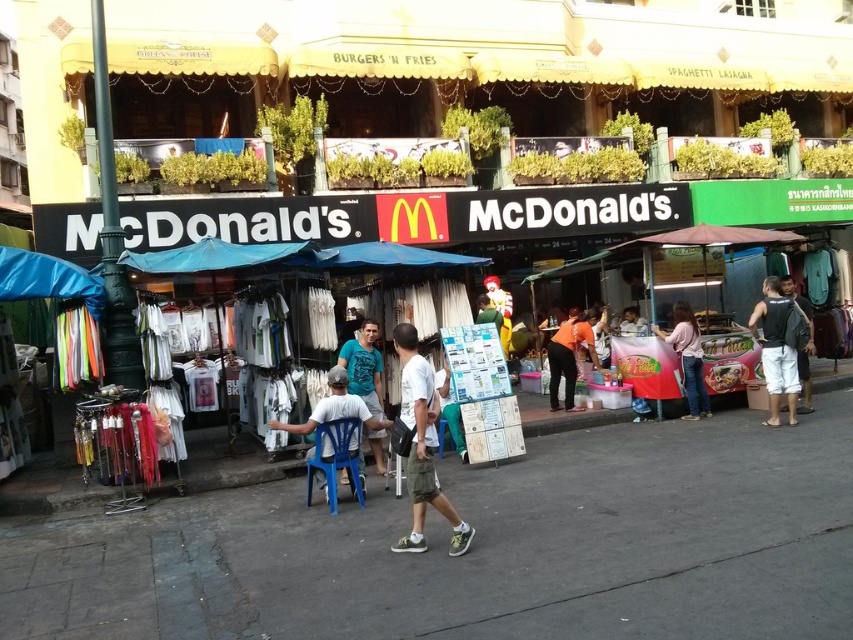
Between gray concrete pavement at center and pink fabric dress at center, which one appears on the right side from the viewer's perspective?

From the viewer's perspective, pink fabric dress at center appears more on the right side.

Is gray concrete pavement at center positioned at the back of pink fabric dress at center?

No, gray concrete pavement at center is closer to the viewer.

At what (x,y) coordinates should I click in order to perform the action: click on gray concrete pavement at center. Please return your answer as a coordinate pair (x, y). Looking at the image, I should click on (480, 548).

Locate an element on the screen. The width and height of the screenshot is (853, 640). gray concrete pavement at center is located at coordinates (480, 548).

Is point (346, 369) positioned behind point (810, 410)?

No, (346, 369) is in front of (810, 410).

Locate an element on the screen. The image size is (853, 640). green t-shirt at center is located at coordinates (364, 365).

Does point (368, 339) come behind point (781, 288)?

No, it is in front of (781, 288).

Image resolution: width=853 pixels, height=640 pixels. In order to click on green t-shirt at center in this screenshot , I will do `click(364, 365)`.

Can you confirm if gray concrete pavement at center is positioned above white fabric shirt at center?

No.

Who is positioned more to the right, gray concrete pavement at center or white fabric shirt at center?

gray concrete pavement at center

Does point (636, 579) come in front of point (352, 445)?

Yes.

Find the location of a particular element. gray concrete pavement at center is located at coordinates (480, 548).